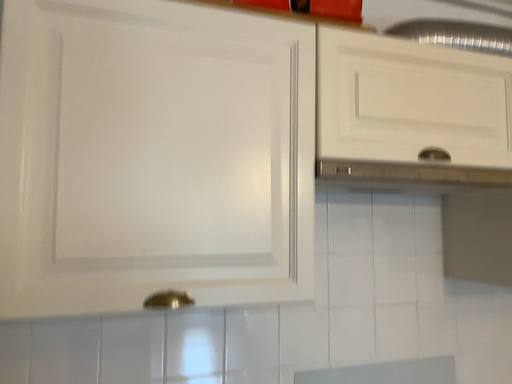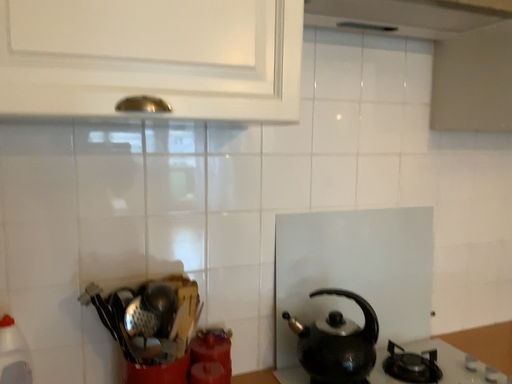
Question: How did the camera likely rotate when shooting the video?

Choices:
 (A) rotated downward
 (B) rotated upward

Answer: (A)